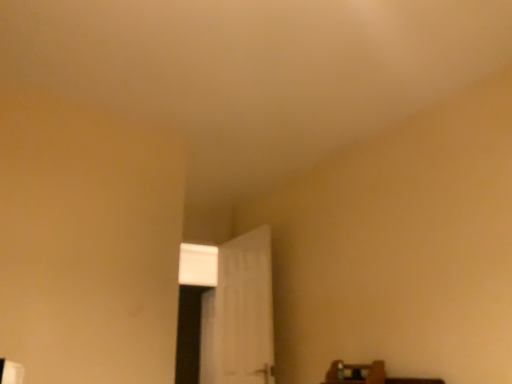
What do you see at coordinates (244, 311) in the screenshot? The height and width of the screenshot is (384, 512). I see `white matte door at center` at bounding box center [244, 311].

At what (x,y) coordinates should I click in order to perform the action: click on white matte door at center. Please return your answer as a coordinate pair (x, y). Looking at the image, I should click on (244, 311).

Find the location of a particular element. white matte door at center is located at coordinates (244, 311).